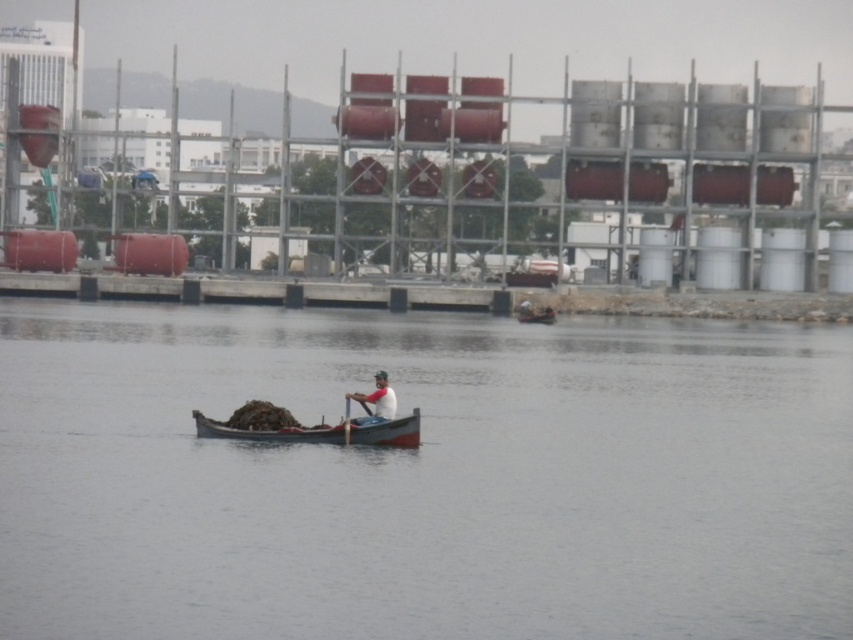
Measure the distance from clear water at center to wooden canoe at center.

79.09 feet

Is clear water at center positioned at the back of wooden canoe at center?

No, it is in front of wooden canoe at center.

Is point (645, 381) farther from camera compared to point (531, 314)?

That is False.

Where is `clear water at center`? This screenshot has width=853, height=640. clear water at center is located at coordinates (422, 476).

Between point (390, 403) and point (538, 317), which one is positioned behind?

The point (538, 317) is behind.

Where is `white matte shirt at center`? white matte shirt at center is located at coordinates (376, 401).

Where is `clear water at center`? The height and width of the screenshot is (640, 853). clear water at center is located at coordinates (422, 476).

Which is below, clear water at center or wooden boat at center?

wooden boat at center is below.

Which is in front, point (125, 476) or point (387, 442)?

Positioned in front is point (125, 476).

I want to click on clear water at center, so click(422, 476).